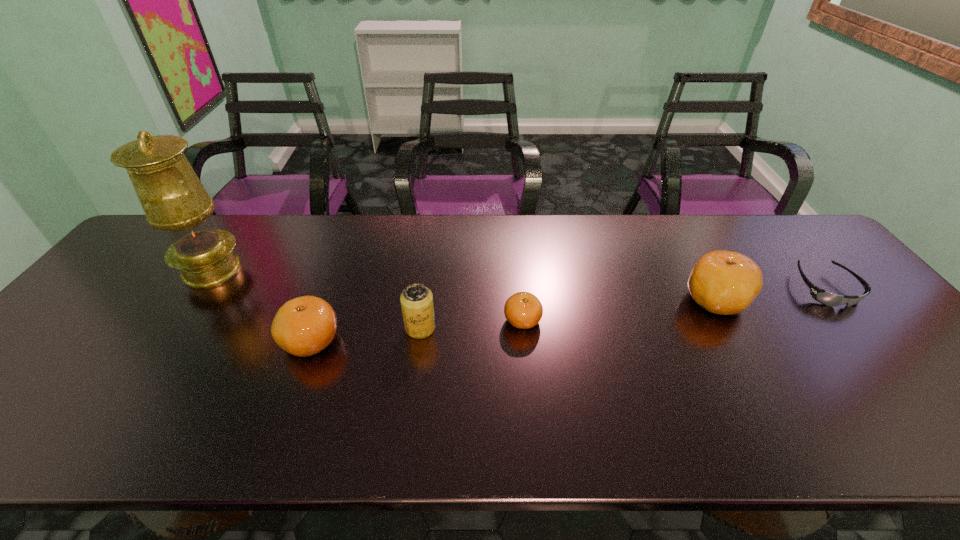
In the image, there is a desktop. Where is `blank space at the left edge`? blank space at the left edge is located at coordinates (57, 375).

In the image, there is a desktop. Where is `vacant space at the right edge`? vacant space at the right edge is located at coordinates (861, 291).

At what (x,y) coordinates should I click in order to perform the action: click on free space between the second clementine from left to right and the tallest object. Please return your answer as a coordinate pair (x, y). This screenshot has width=960, height=540. Looking at the image, I should click on (367, 295).

Where is `vacant space that's between the sunglasses and the shortest clementine`? This screenshot has width=960, height=540. vacant space that's between the sunglasses and the shortest clementine is located at coordinates (674, 305).

Find the location of `vacant area that lies between the shortest object and the beer can`. vacant area that lies between the shortest object and the beer can is located at coordinates (623, 308).

Identify the location of vacant point located between the shortest object and the oil lamp. (518, 279).

Identify the location of blank region between the third object from left to right and the rightmost clementine. (568, 314).

This screenshot has height=540, width=960. What are the coordinates of `empty location between the sunglasses and the leftmost clementine` in the screenshot? It's located at (568, 315).

Where is `unoccupied area between the tallest object and the shortest object`? unoccupied area between the tallest object and the shortest object is located at coordinates (518, 279).

Locate an element on the screen. This screenshot has width=960, height=540. empty location between the second tallest clementine and the leftmost object is located at coordinates (261, 306).